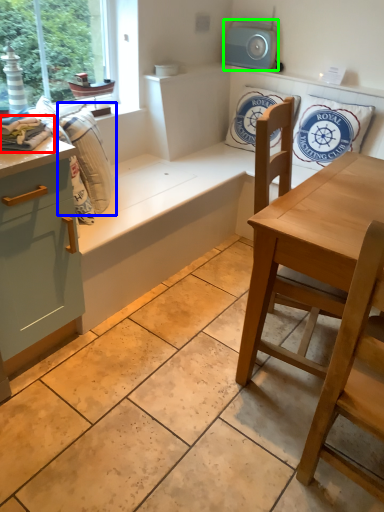
Question: Estimate the real-world distances between objects in this image. Which object is closer to material (highlighted by a red box), laundry (highlighted by a blue box) or appliance (highlighted by a green box)?

Choices:
 (A) laundry
 (B) appliance

Answer: (A)